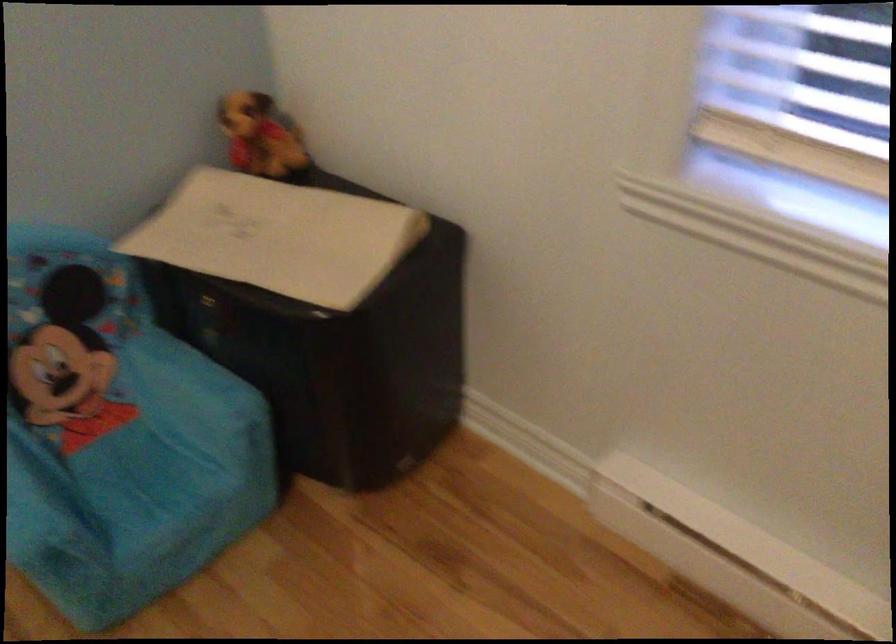
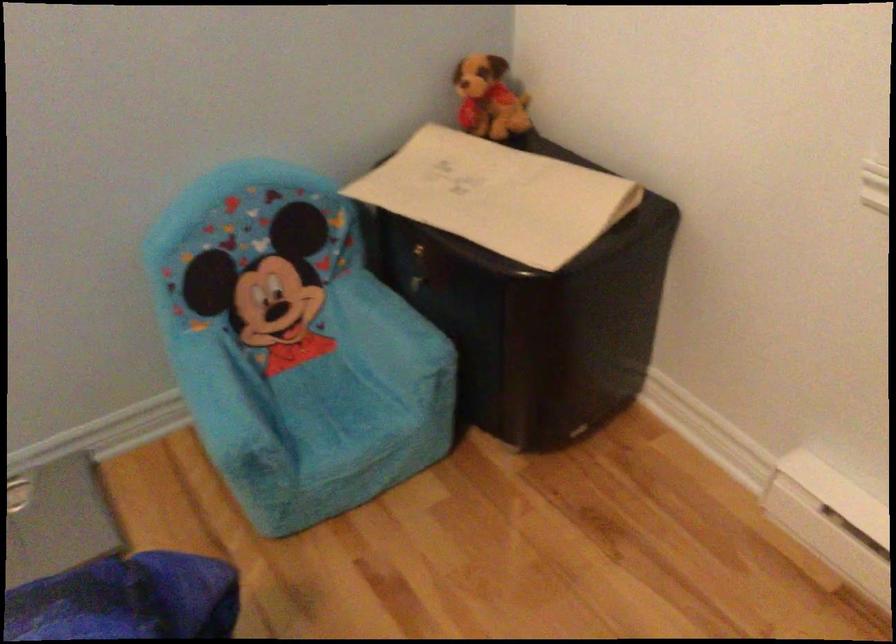
The point at (x=175, y=469) is marked in the first image. Where is the corresponding point in the second image?

(364, 402)